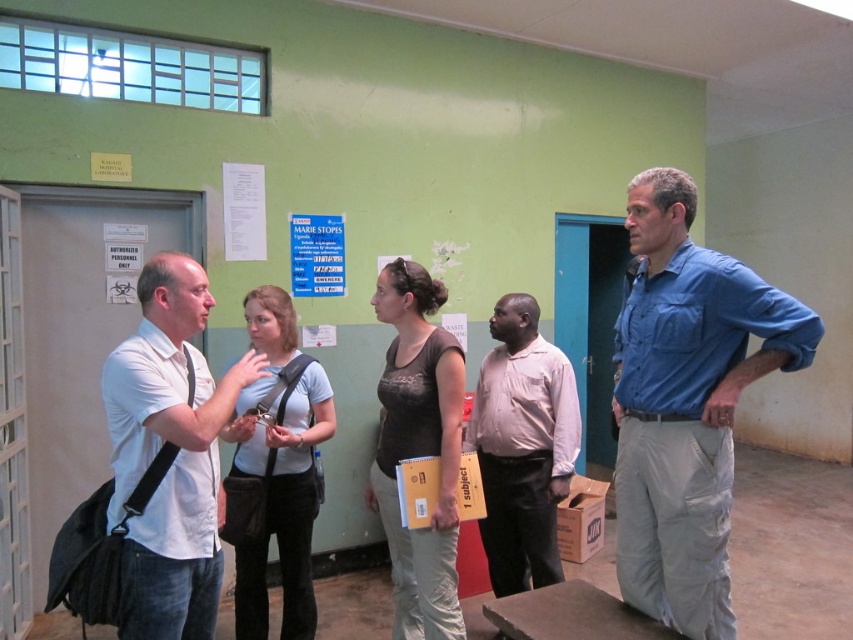
Question: Which point is farther from the camera taking this photo?

Choices:
 (A) (498, 465)
 (B) (231, 368)

Answer: (A)

Question: Is blue cotton shirt at center above light brown shirt at center?

Choices:
 (A) no
 (B) yes

Answer: (B)

Question: Estimate the real-world distances between objects in this image. Which object is farther from the blue cotton shirt at center?

Choices:
 (A) light brown shirt at center
 (B) white matte shirt at left

Answer: (B)

Question: Is blue cotton shirt at center wider than white matte shirt at left?

Choices:
 (A) yes
 (B) no

Answer: (A)

Question: Observing the image, what is the correct spatial positioning of white matte shirt at left in reference to light brown shirt at center?

Choices:
 (A) below
 (B) above

Answer: (B)

Question: Which object is the farthest from the white matte shirt at left?

Choices:
 (A) light brown shirt at center
 (B) blue cotton shirt at center

Answer: (A)